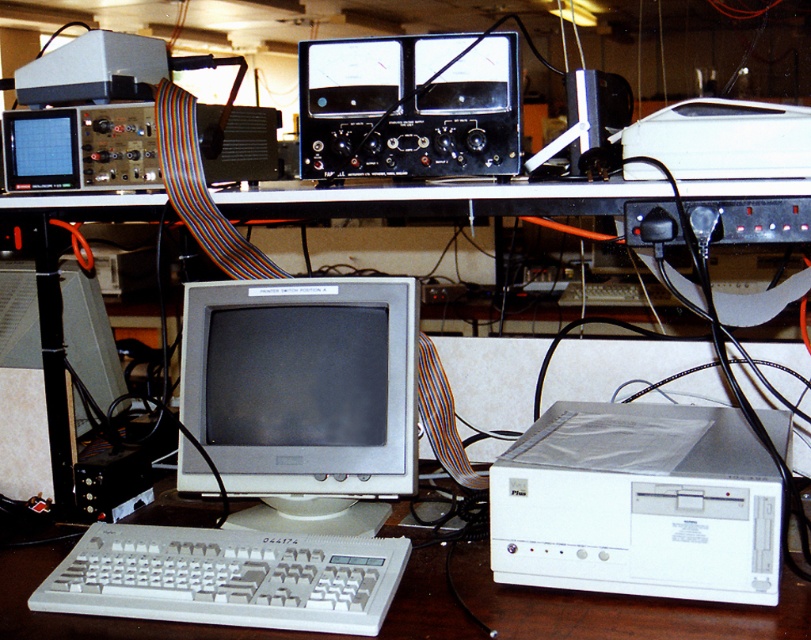
Is matte gray monitor at center smaller than white plastic computer at lower right?

Yes, matte gray monitor at center is smaller than white plastic computer at lower right.

The height and width of the screenshot is (640, 811). Describe the element at coordinates (303, 396) in the screenshot. I see `matte gray monitor at center` at that location.

Which is behind, point (217, 308) or point (651, 570)?

The point (217, 308) is more distant.

Where is `matte gray monitor at center`? This screenshot has height=640, width=811. matte gray monitor at center is located at coordinates (303, 396).

Does matte gray monitor at center have a greater width compared to white plastic keyboard at lower left?

In fact, matte gray monitor at center might be narrower than white plastic keyboard at lower left.

The width and height of the screenshot is (811, 640). What do you see at coordinates (303, 396) in the screenshot? I see `matte gray monitor at center` at bounding box center [303, 396].

Image resolution: width=811 pixels, height=640 pixels. Identify the location of matte gray monitor at center. (303, 396).

Measure the distance from white plastic computer at lower right to white plastic keyboard at lower left.

white plastic computer at lower right and white plastic keyboard at lower left are 14.78 inches apart from each other.

Does point (655, 426) come behind point (172, 608)?

Yes, it is behind point (172, 608).

Does point (501, 496) come in front of point (376, 547)?

Yes, point (501, 496) is closer to viewer.

Locate an element on the screen. Image resolution: width=811 pixels, height=640 pixels. white plastic computer at lower right is located at coordinates (638, 502).